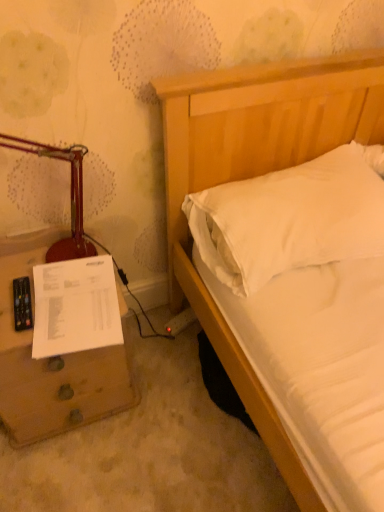
The height and width of the screenshot is (512, 384). Find the location of `free space in front of brown wooden nightstand at lower left`. free space in front of brown wooden nightstand at lower left is located at coordinates (74, 472).